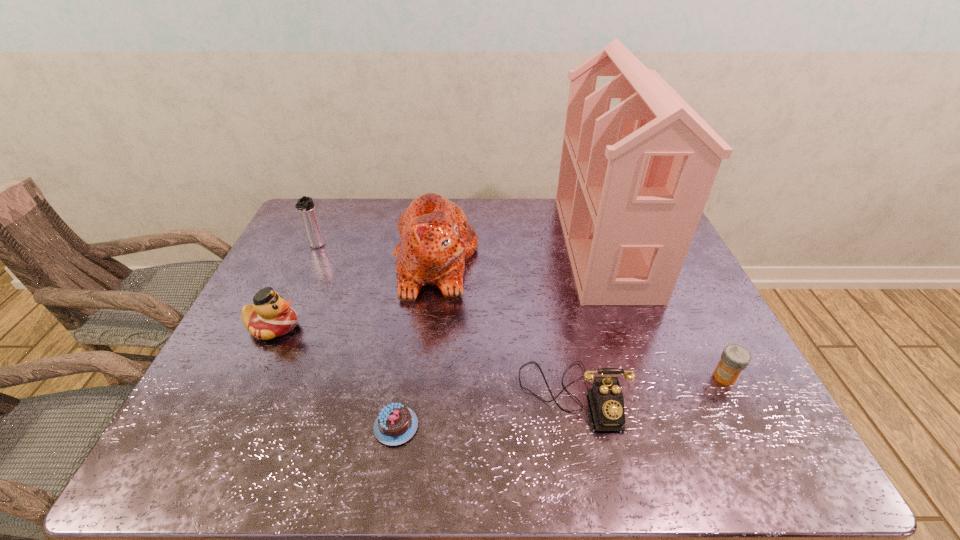
Image resolution: width=960 pixels, height=540 pixels. I want to click on vacant space at the left edge of the desktop, so click(254, 366).

This screenshot has height=540, width=960. What are the coordinates of `vacant area at the right edge of the desktop` in the screenshot? It's located at (708, 321).

The width and height of the screenshot is (960, 540). In order to click on free space at the far left corner of the desktop in this screenshot , I will do (x=343, y=218).

Identify the location of vacant space at the near left corner. The width and height of the screenshot is (960, 540). (198, 437).

Locate an element on the screen. This screenshot has width=960, height=540. vacant space at the near right corner of the desktop is located at coordinates (737, 444).

Locate an element on the screen. The width and height of the screenshot is (960, 540). unoccupied position between the second shortest object and the second tallest object is located at coordinates (580, 319).

The image size is (960, 540). I want to click on vacant space that's between the cat and the fifth tallest object, so click(x=504, y=328).

At what (x,y) coordinates should I click in order to perform the action: click on free space between the dollhouse and the second shortest object. Please return your answer as a coordinate pair (x, y). This screenshot has height=540, width=960. Looking at the image, I should click on (664, 311).

Image resolution: width=960 pixels, height=540 pixels. What are the coordinates of `free space between the duck and the fifth tallest object` in the screenshot? It's located at (423, 361).

Where is `vacant point located between the cat and the chocolate cake`? Image resolution: width=960 pixels, height=540 pixels. vacant point located between the cat and the chocolate cake is located at coordinates (416, 344).